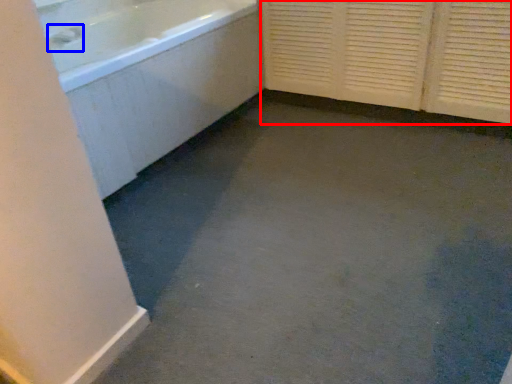
Question: Which point is further to the camera, screen door (highlighted by a red box) or faucet (highlighted by a blue box)?

Choices:
 (A) screen door
 (B) faucet

Answer: (B)